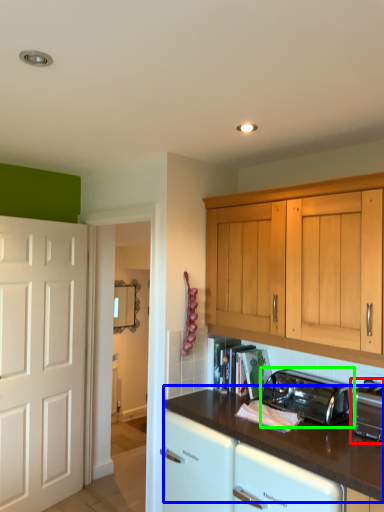
Question: Based on their relative distances, which object is nearer to toaster (highlighted by a red box)? Choose from countertop (highlighted by a blue box) and toaster (highlighted by a green box).

Choices:
 (A) countertop
 (B) toaster

Answer: (B)